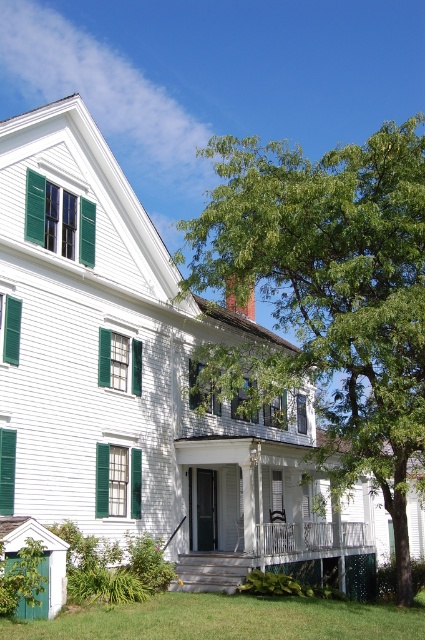
You are standing on the front lawn of the house and want to take a photo of the green matte shutter at lower left without the white wooden porch at center blocking the view. Is this possible?

The green matte shutter at lower left is behind the white wooden porch at center, so it would be blocked from view when standing on the front lawn. You would need to move to a position where the porch is not in front of the shutter to take the photo.